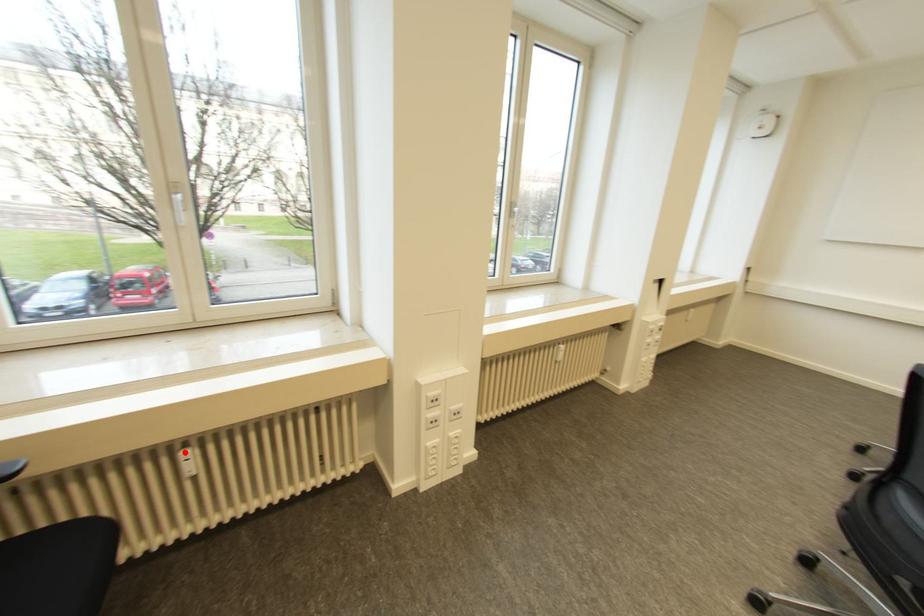
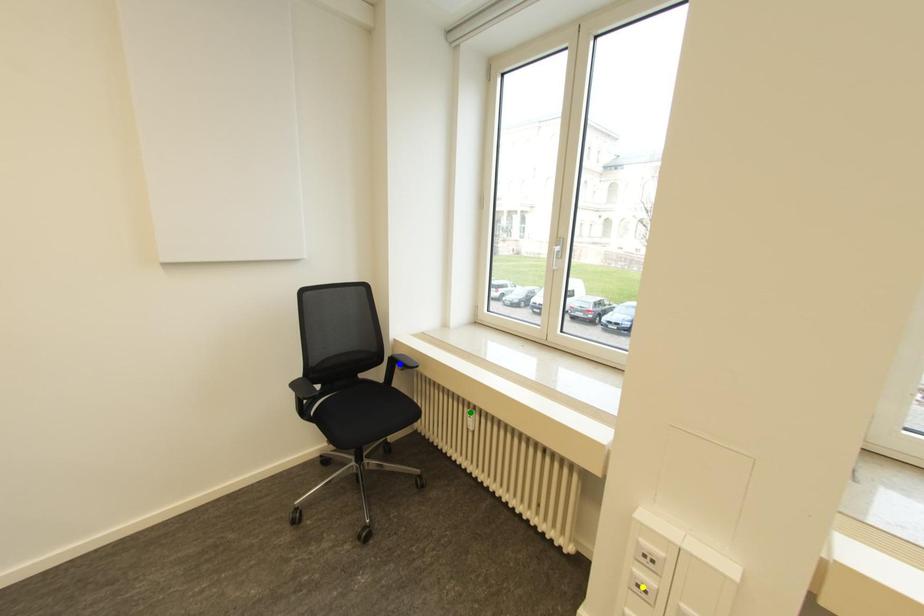
Question: I am providing you with two images of the same scene from different viewpoints. A red point is marked on the first image. You are given multiple points on the second image. Can you choose the point in image 2 that corresponds to the point in image 1?

Choices:
 (A) blue point
 (B) yellow point
 (C) green point

Answer: (C)